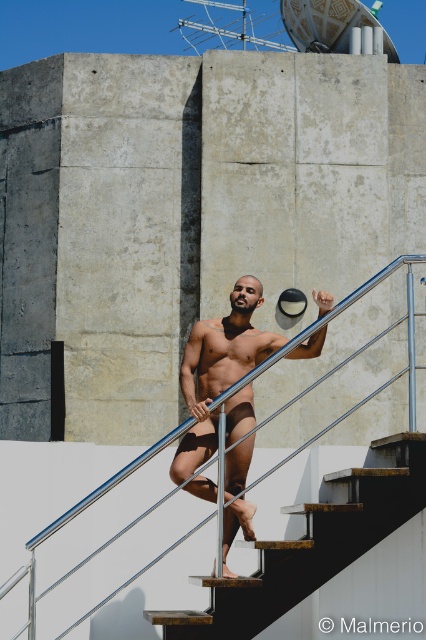
Question: Which object is positioned closest to the silver metallic rail at upper center?

Choices:
 (A) wooden stair at center
 (B) matte black underwear at center

Answer: (B)

Question: Is wooden stair at center to the left of silver metallic rail at upper center from the viewer's perspective?

Choices:
 (A) no
 (B) yes

Answer: (A)

Question: Does matte black underwear at center have a smaller size compared to silver metallic rail at upper center?

Choices:
 (A) yes
 (B) no

Answer: (A)

Question: Estimate the real-world distances between objects in this image. Which object is closer to the wooden stair at center?

Choices:
 (A) silver metallic rail at upper center
 (B) matte black underwear at center

Answer: (B)

Question: Does wooden stair at center appear over silver metallic rail at upper center?

Choices:
 (A) no
 (B) yes

Answer: (A)

Question: Among these objects, which one is farthest from the camera?

Choices:
 (A) silver metallic rail at upper center
 (B) wooden stair at center
 (C) matte black underwear at center

Answer: (C)